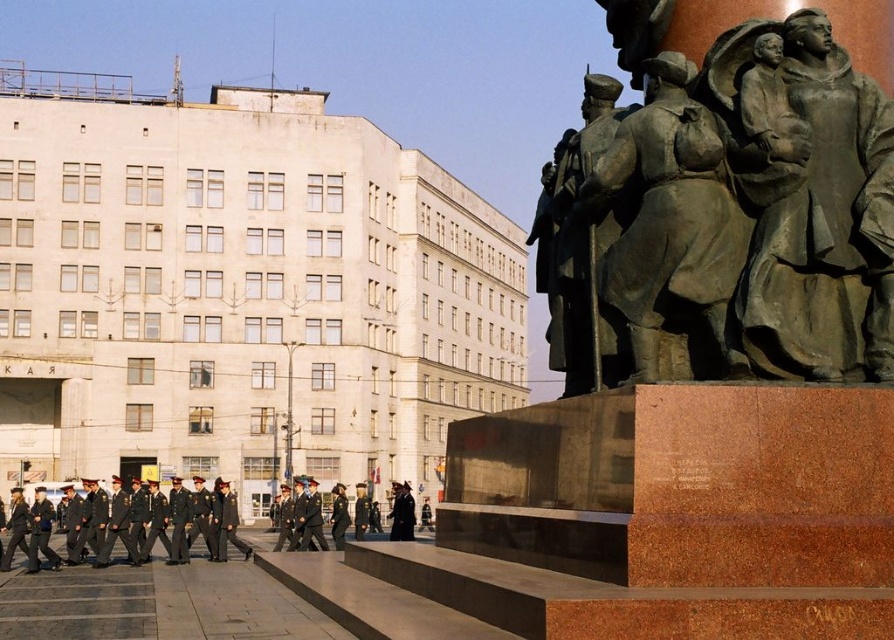
Question: Which object appears farthest from the camera in this image?

Choices:
 (A) bronze statue at center
 (B) bronze statue of woman holding child at right

Answer: (A)

Question: Considering the relative positions of bronze statue at center and dark green uniform at lower left in the image provided, where is bronze statue at center located with respect to dark green uniform at lower left?

Choices:
 (A) right
 (B) left

Answer: (A)

Question: Among these points, which one is farthest from the camera?

Choices:
 (A) (744, 1)
 (B) (786, 371)
 (C) (617, 353)

Answer: (A)

Question: Does bronze sculpture at right lie behind dark green uniform at lower left?

Choices:
 (A) yes
 (B) no

Answer: (B)

Question: Does bronze sculpture at right have a greater width compared to bronze statue of woman holding child at right?

Choices:
 (A) no
 (B) yes

Answer: (B)

Question: Which point appears farthest from the camera in this image?

Choices:
 (A) (538, 209)
 (B) (846, 253)

Answer: (A)